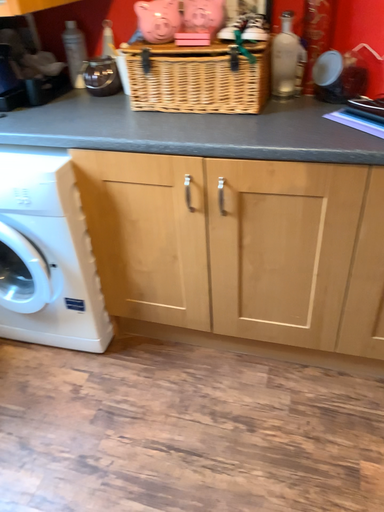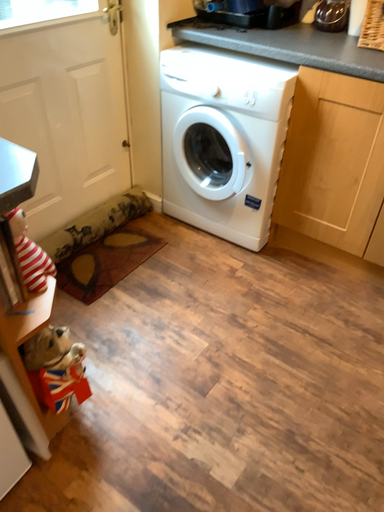
Question: Which way did the camera rotate in the video?

Choices:
 (A) rotated right
 (B) rotated left

Answer: (B)